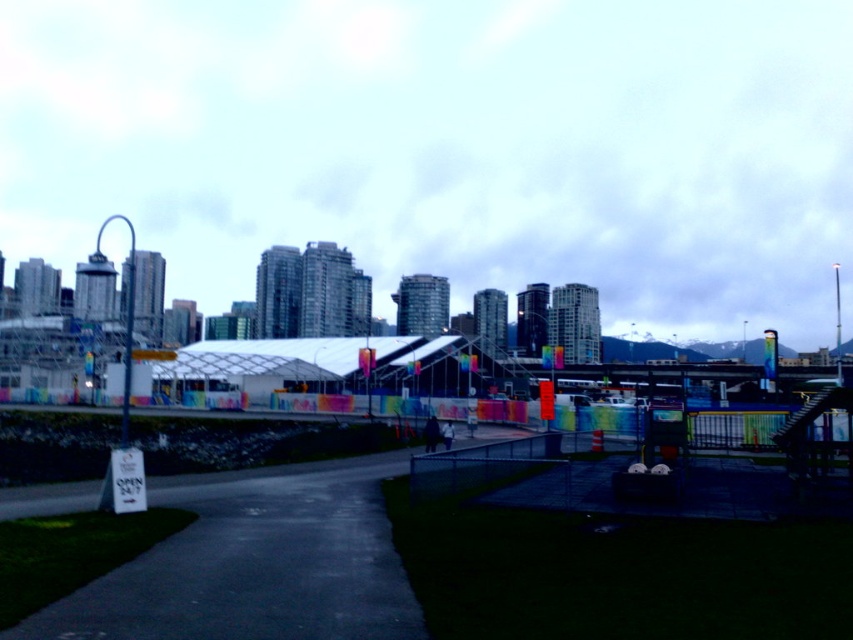
Question: Is transparent glass canopy at center to the left of dark asphalt path at center from the viewer's perspective?

Choices:
 (A) no
 (B) yes

Answer: (A)

Question: Does transparent glass canopy at center have a greater width compared to dark asphalt path at center?

Choices:
 (A) no
 (B) yes

Answer: (B)

Question: Does transparent glass canopy at center come behind dark asphalt path at center?

Choices:
 (A) yes
 (B) no

Answer: (A)